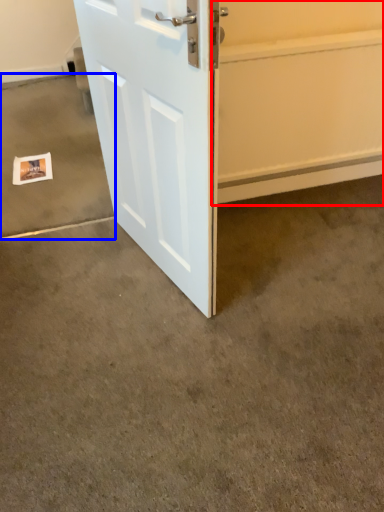
Question: Among these objects, which one is nearest to the camera, garage door (highlighted by a red box) or concrete (highlighted by a blue box)?

Choices:
 (A) garage door
 (B) concrete

Answer: (A)